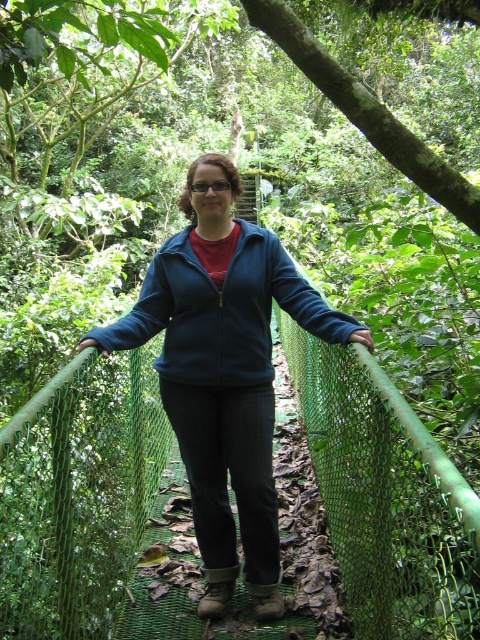
Is blue fleece jacket at center taller than blue fleece sweatshirt at center?

Correct, blue fleece jacket at center is much taller as blue fleece sweatshirt at center.

Which is above, blue fleece jacket at center or blue fleece sweatshirt at center?

Positioned higher is blue fleece sweatshirt at center.

Where is `blue fleece jacket at center`? This screenshot has height=640, width=480. blue fleece jacket at center is located at coordinates (224, 372).